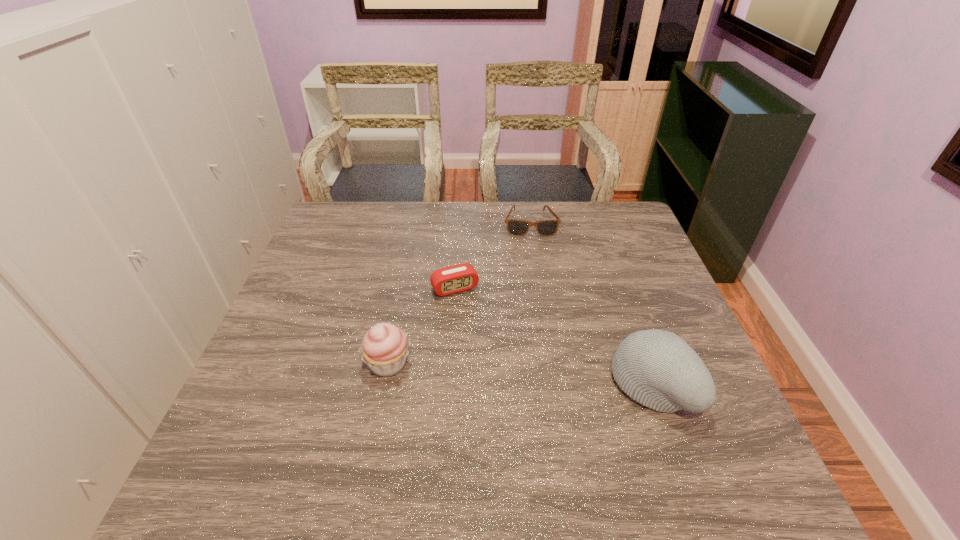
Where is `vacant area that lies between the sunglasses and the beanie`? vacant area that lies between the sunglasses and the beanie is located at coordinates (591, 304).

Locate an element on the screen. empty location between the third nearest object and the farthest object is located at coordinates (492, 256).

Where is `empty space between the farthest object and the cupcake`? Image resolution: width=960 pixels, height=540 pixels. empty space between the farthest object and the cupcake is located at coordinates (460, 294).

At what (x,y) coordinates should I click in order to perform the action: click on free space between the sunglasses and the beanie. Please return your answer as a coordinate pair (x, y). This screenshot has height=540, width=960. Looking at the image, I should click on tap(591, 304).

Identify the location of object that stands as the closest to the rightmost object. Image resolution: width=960 pixels, height=540 pixels. (457, 278).

Identify which object is located as the third nearest to the second farthest object. Please provide its 2D coordinates. Your answer should be formatted as a tuple, i.e. [(x, y)], where the tuple contains the x and y coordinates of a point satisfying the conditions above.

[(658, 369)]

This screenshot has width=960, height=540. Identify the location of free location that satisfies the following two spatial constraints: 1. on the front side of the rightmost object; 2. on the right side of the sunglasses. coord(555,384).

Find the location of a particular element. free space that satisfies the following two spatial constraints: 1. on the back side of the alarm clock; 2. on the left side of the sunglasses is located at coordinates [459, 224].

The image size is (960, 540). I want to click on free space that satisfies the following two spatial constraints: 1. on the back side of the third nearest object; 2. on the left side of the third object from left to right, so click(459, 224).

The image size is (960, 540). Identify the location of vacant region that satisfies the following two spatial constraints: 1. on the back side of the sunglasses; 2. on the left side of the alarm clock. (459, 224).